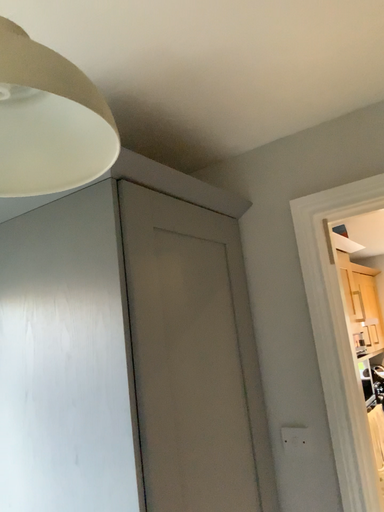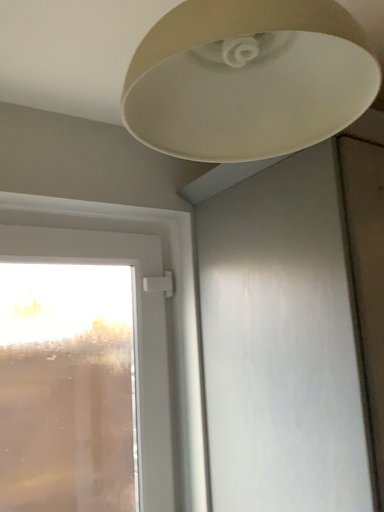
Question: How did the camera likely rotate when shooting the video?

Choices:
 (A) rotated right
 (B) rotated left

Answer: (B)